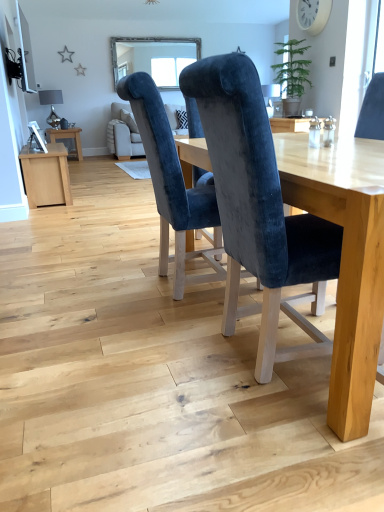
Question: Is velvet blue chair at center, acting as the 1th chair starting from the left, facing away from velvet blue chair at center, the first chair positioned from the right?

Choices:
 (A) no
 (B) yes

Answer: (A)

Question: Does velvet blue chair at center, acting as the 1th chair starting from the left, have a larger size compared to velvet blue chair at center, the second chair in the left-to-right sequence?

Choices:
 (A) no
 (B) yes

Answer: (A)

Question: Is velvet blue chair at center, acting as the 1th chair starting from the left, shorter than velvet blue chair at center, the first chair positioned from the right?

Choices:
 (A) yes
 (B) no

Answer: (A)

Question: From a real-world perspective, is velvet blue chair at center, acting as the 1th chair starting from the left, under velvet blue chair at center, the first chair positioned from the right?

Choices:
 (A) no
 (B) yes

Answer: (A)

Question: Is velvet blue chair at center, acting as the 1th chair starting from the left, in contact with velvet blue chair at center, the first chair positioned from the right?

Choices:
 (A) yes
 (B) no

Answer: (B)

Question: From a real-world perspective, is wooden side table at left physically located above or below clear glass window at upper center?

Choices:
 (A) above
 (B) below

Answer: (B)

Question: Considering the positions of point (59, 134) and point (180, 58), is point (59, 134) closer or farther from the camera than point (180, 58)?

Choices:
 (A) closer
 (B) farther

Answer: (A)

Question: Would you say wooden side table at left is inside or outside clear glass window at upper center?

Choices:
 (A) outside
 (B) inside

Answer: (A)

Question: From the image's perspective, is wooden side table at left positioned above or below clear glass window at upper center?

Choices:
 (A) below
 (B) above

Answer: (A)

Question: Is clear glass window at upper center taller or shorter than wooden side table at left?

Choices:
 (A) short
 (B) tall

Answer: (B)

Question: Relative to wooden side table at left, is clear glass window at upper center in front or behind?

Choices:
 (A) front
 (B) behind

Answer: (B)

Question: From a real-world perspective, is clear glass window at upper center above or below wooden side table at left?

Choices:
 (A) below
 (B) above

Answer: (B)

Question: Which is correct: clear glass window at upper center is inside wooden side table at left, or outside of it?

Choices:
 (A) inside
 (B) outside

Answer: (B)

Question: Is point (117, 62) closer or farther from the camera than point (299, 222)?

Choices:
 (A) closer
 (B) farther

Answer: (B)

Question: From a real-world perspective, is clear glass window at upper center physically located above or below velvet blue chair at center, the second chair in the left-to-right sequence?

Choices:
 (A) below
 (B) above

Answer: (B)